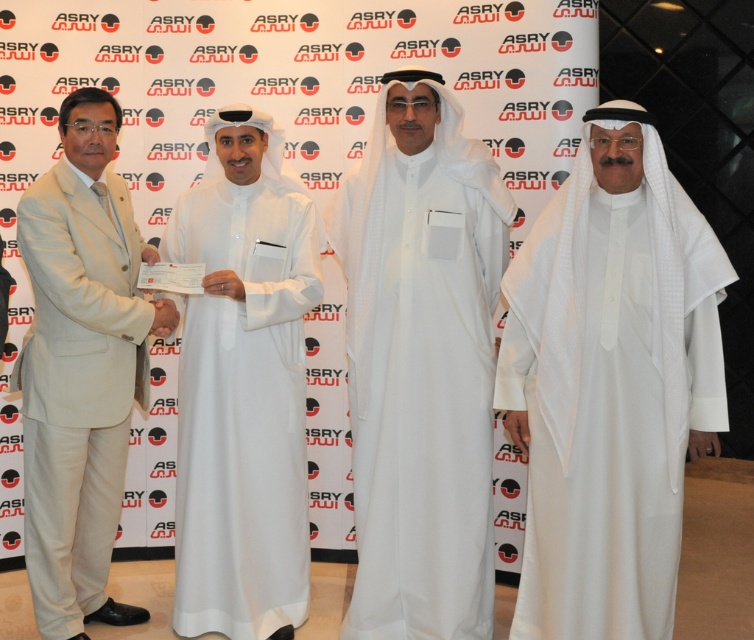
Does white cotton thobe at center have a lesser width compared to white matte abaya at center?

In fact, white cotton thobe at center might be wider than white matte abaya at center.

Locate an element on the screen. Image resolution: width=754 pixels, height=640 pixels. white cotton thobe at center is located at coordinates (421, 364).

Can you confirm if white textured thobe at center is taller than white cotton thobe at center?

No, white textured thobe at center is not taller than white cotton thobe at center.

Is white textured thobe at center bigger than white cotton thobe at center?

Yes.

Is point (564, 381) positioned behind point (412, 483)?

No.

This screenshot has height=640, width=754. Find the location of `white textured thobe at center`. white textured thobe at center is located at coordinates (610, 381).

Who is shorter, white textured thobe at center or white matte abaya at center?

With less height is white textured thobe at center.

Is point (592, 339) positioned in front of point (284, 193)?

Yes, it is in front of point (284, 193).

Find the location of a particular element. white textured thobe at center is located at coordinates (610, 381).

Image resolution: width=754 pixels, height=640 pixels. In order to click on white textured thobe at center in this screenshot , I will do `click(610, 381)`.